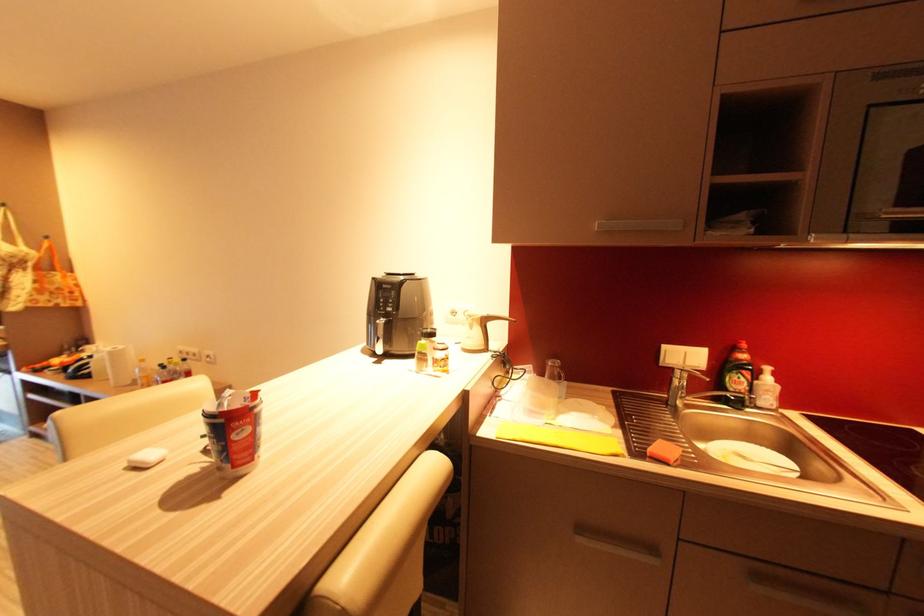
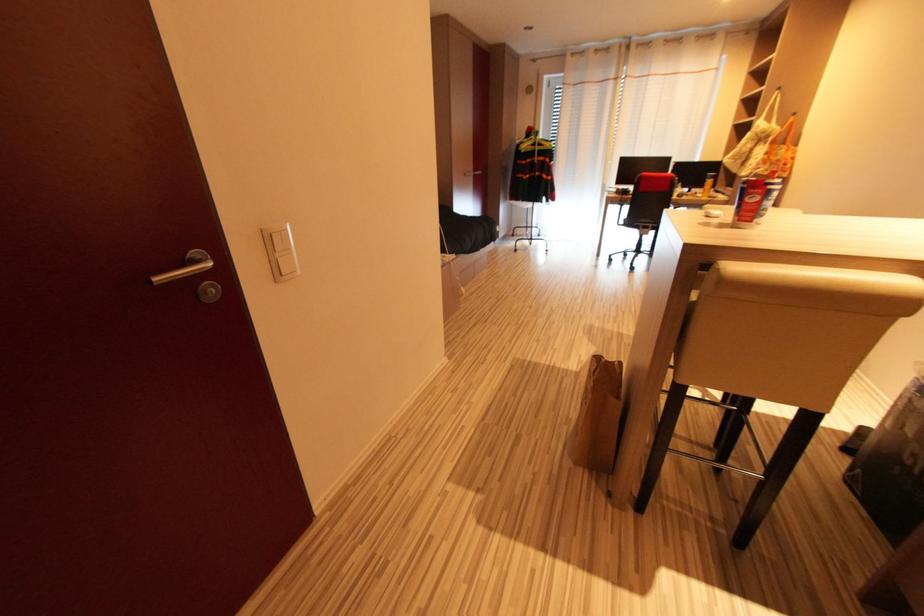
How did the camera likely rotate?

The camera rotated toward left-down.